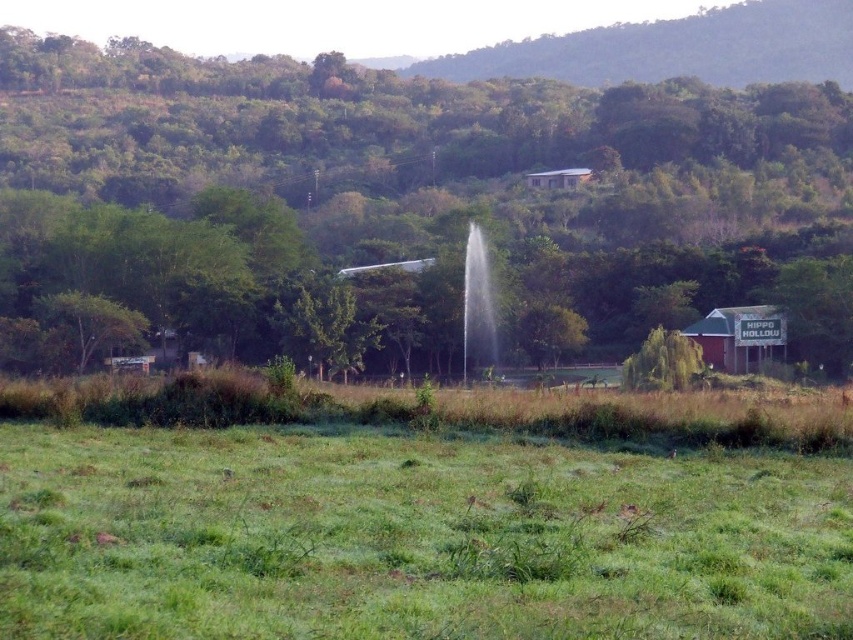
Is green leafy tree at center bigger than green leafy tree at center-right?

Indeed, green leafy tree at center has a larger size compared to green leafy tree at center-right.

What do you see at coordinates (407, 202) in the screenshot? The image size is (853, 640). I see `green leafy tree at center` at bounding box center [407, 202].

This screenshot has height=640, width=853. I want to click on green leafy tree at center, so click(x=407, y=202).

Does green leafy hillside at upper center have a smaller size compared to green leafy tree at center-right?

Actually, green leafy hillside at upper center might be larger than green leafy tree at center-right.

Who is taller, green leafy hillside at upper center or green leafy tree at center-right?

Standing taller between the two is green leafy hillside at upper center.

What do you see at coordinates (676, 49) in the screenshot? I see `green leafy hillside at upper center` at bounding box center [676, 49].

The width and height of the screenshot is (853, 640). I want to click on green leafy hillside at upper center, so (676, 49).

Which is more to the right, green leafy tree at center or green leafy hillside at upper center?

green leafy hillside at upper center is more to the right.

Who is more forward, (589, 241) or (512, 42)?

Point (589, 241) is more forward.

Which is behind, point (331, 257) or point (608, 54)?

Positioned behind is point (608, 54).

Identify the location of green leafy tree at center. This screenshot has width=853, height=640. (407, 202).